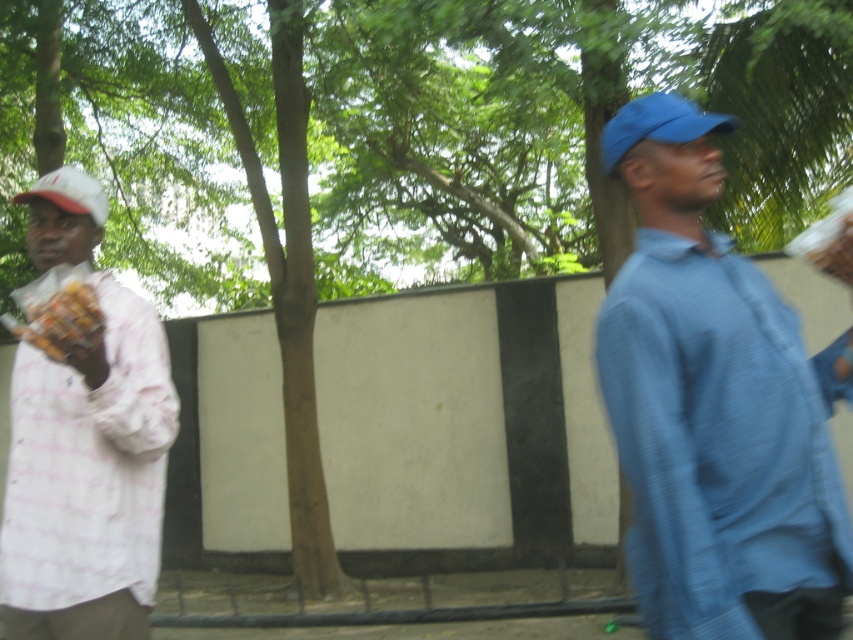
Can you confirm if blue fabric shirt at right is positioned above white matte cap at left?

Actually, blue fabric shirt at right is below white matte cap at left.

Can you confirm if blue fabric shirt at right is thinner than white matte cap at left?

No, blue fabric shirt at right is not thinner than white matte cap at left.

Is point (665, 323) positioned before point (91, 182)?

Yes, it is.

Where is `blue fabric shirt at right`? This screenshot has height=640, width=853. blue fabric shirt at right is located at coordinates (715, 406).

Does white checkered shirt at left have a greater width compared to blue fabric cap at upper right?

Yes, white checkered shirt at left is wider than blue fabric cap at upper right.

Who is more forward, (45, 392) or (602, 132)?

Point (45, 392)

Locate an element on the screen. The width and height of the screenshot is (853, 640). white checkered shirt at left is located at coordinates (86, 477).

Who is lower down, white checkered shirt at left or brown crumbly snack at left?

white checkered shirt at left is lower down.

Can you confirm if white checkered shirt at left is shorter than brown crumbly snack at left?

No.

The height and width of the screenshot is (640, 853). What do you see at coordinates (86, 477) in the screenshot?
I see `white checkered shirt at left` at bounding box center [86, 477].

Where is `white checkered shirt at left`? This screenshot has height=640, width=853. white checkered shirt at left is located at coordinates tap(86, 477).